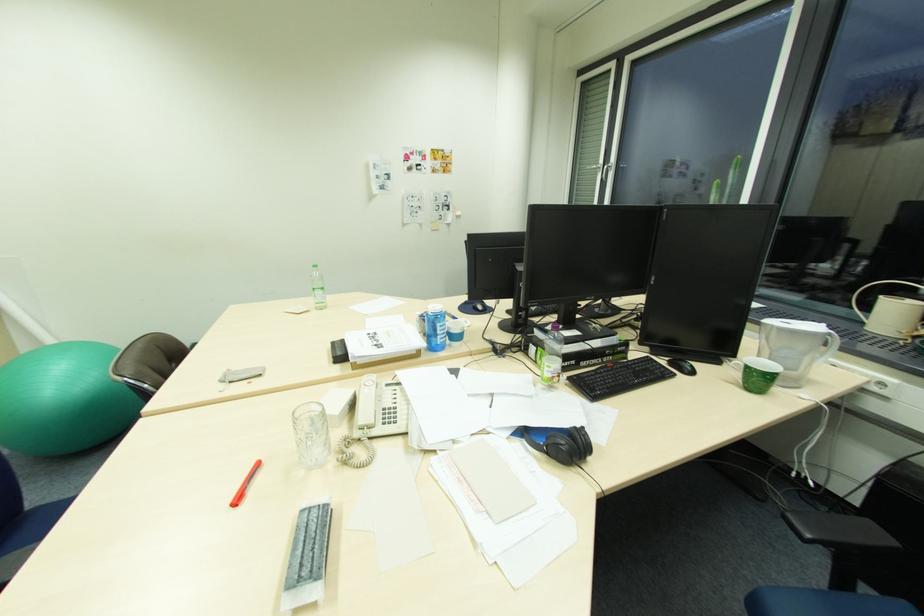
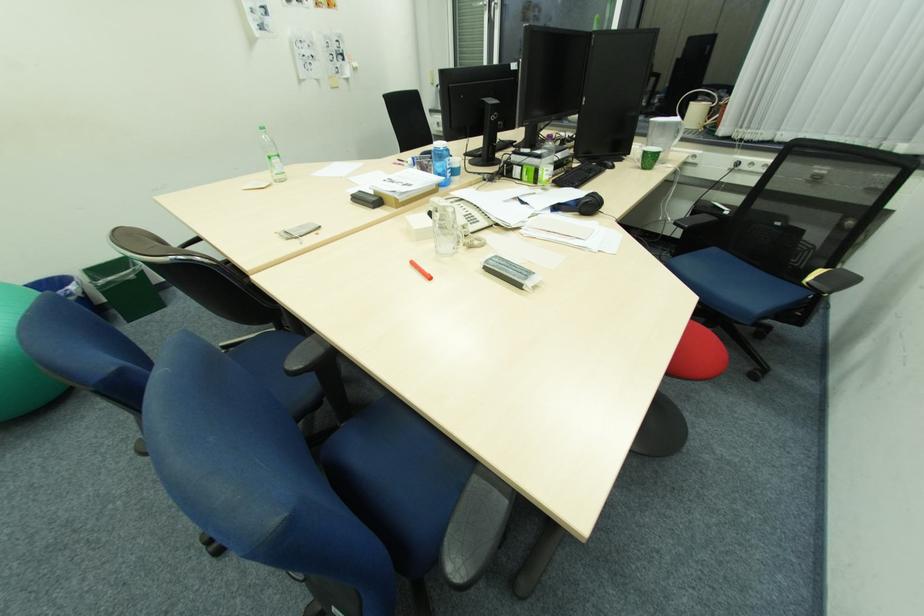
The point at (739, 357) is marked in the first image. Where is the corresponding point in the second image?

(635, 155)